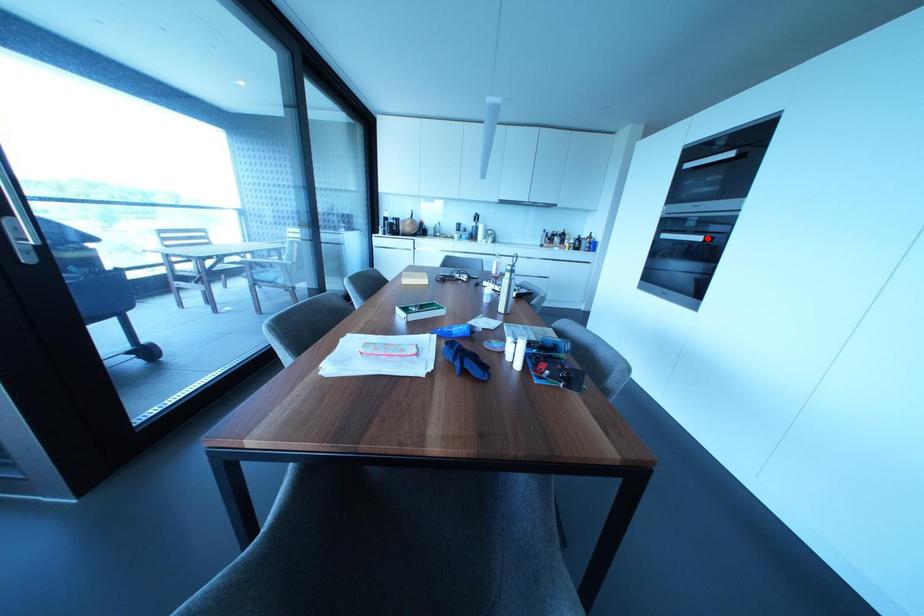
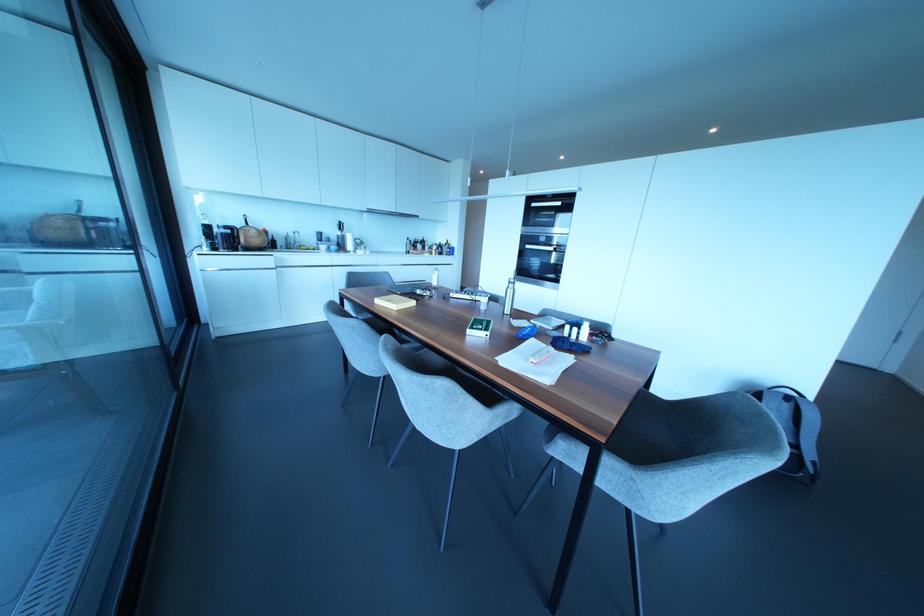
The point at the highlighted location is marked in the first image. Where is the corresponding point in the second image?

(553, 248)